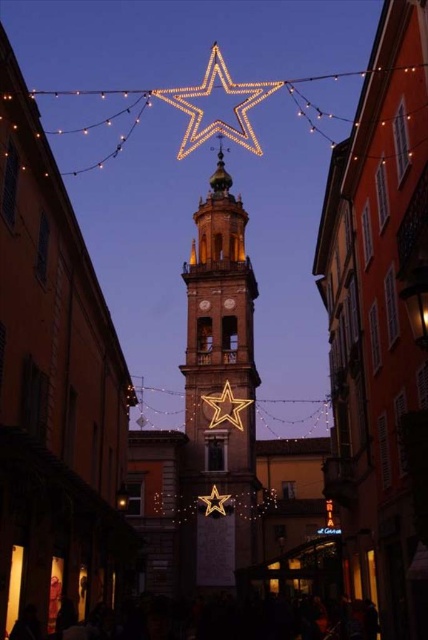
Is point (207, 406) farther from camera compared to point (228, 506)?

That is True.

Does point (246, 404) come in front of point (217, 509)?

No, (246, 404) is behind (217, 509).

Locate an element on the screen. Image resolution: width=428 pixels, height=640 pixels. illuminated gold star at center is located at coordinates (225, 406).

Does point (220, 416) come closer to viewer compared to point (231, 403)?

Yes.

Can you confirm if gold metallic bell tower at center is positioned to the right of illuminated gold star at center?

Indeed, gold metallic bell tower at center is positioned on the right side of illuminated gold star at center.

Is point (196, 275) more distant than point (225, 396)?

Yes, it is behind point (225, 396).

Identify the location of gold metallic bell tower at center. (219, 388).

Who is taller, gold metallic bell tower at center or gold metallic star at center?

With more height is gold metallic bell tower at center.

Does point (198, 492) come behind point (208, 493)?

Yes, point (198, 492) is farther from viewer.

Locate an element on the screen. Image resolution: width=428 pixels, height=640 pixels. gold metallic bell tower at center is located at coordinates (219, 388).